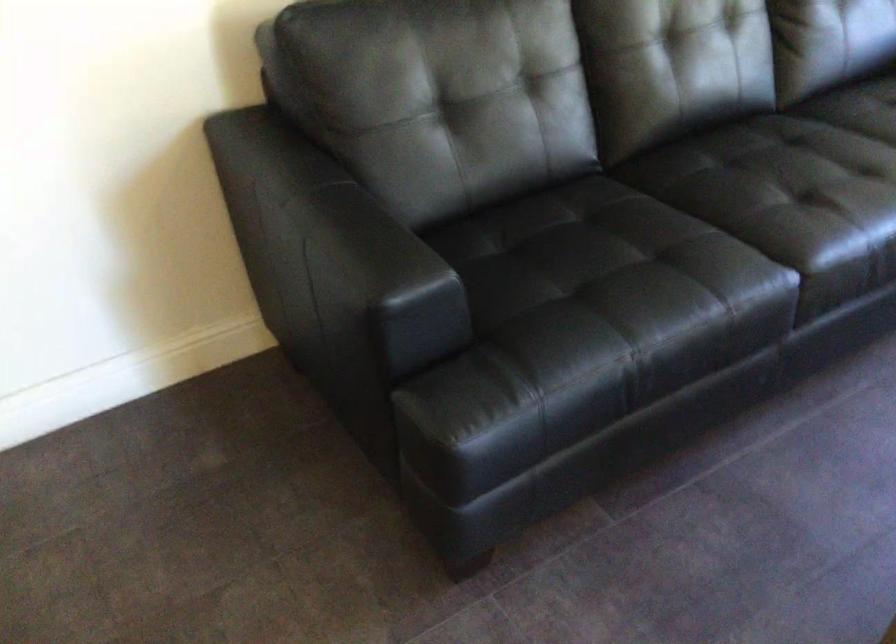
What do you see at coordinates (788, 200) in the screenshot? The width and height of the screenshot is (896, 644). I see `a black sofa sitting surface` at bounding box center [788, 200].